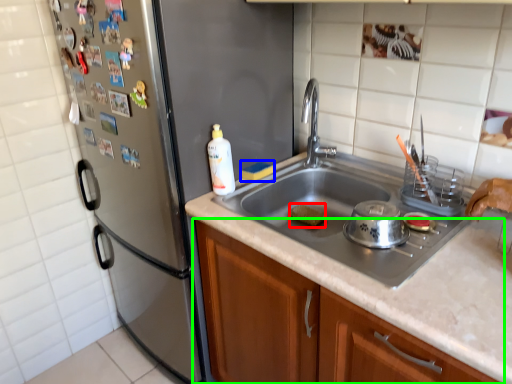
Question: Considering the real-world distances, which object is closest to food (highlighted by a red box)? food (highlighted by a blue box) or cabinetry (highlighted by a green box).

Choices:
 (A) food
 (B) cabinetry

Answer: (A)